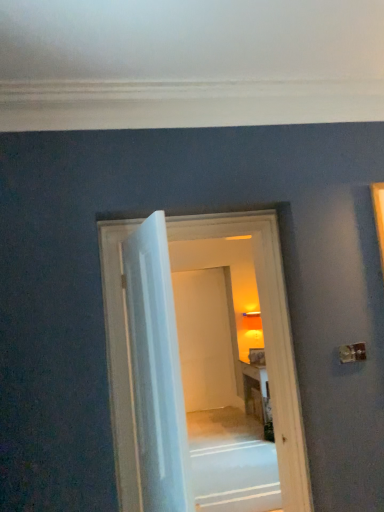
Question: Is white wooden door at center, the second door positioned from the front, not inside white glossy door at center, arranged as the 2th door when viewed from the back?

Choices:
 (A) no
 (B) yes

Answer: (B)

Question: From the image's perspective, does white wooden door at center, the first door from the back, appear lower than white glossy door at center, arranged as the 2th door when viewed from the back?

Choices:
 (A) yes
 (B) no

Answer: (A)

Question: Considering the relative positions of white wooden door at center, the first door from the back, and white glossy door at center, arranged as the 2th door when viewed from the back, in the image provided, is white wooden door at center, the first door from the back, behind white glossy door at center, arranged as the 2th door when viewed from the back,?

Choices:
 (A) yes
 (B) no

Answer: (A)

Question: Is white wooden door at center, the second door positioned from the front, oriented away from white glossy door at center, marked as the first door in a front-to-back arrangement?

Choices:
 (A) no
 (B) yes

Answer: (A)

Question: Can you confirm if white wooden door at center, the second door positioned from the front, is smaller than white glossy door at center, marked as the first door in a front-to-back arrangement?

Choices:
 (A) yes
 (B) no

Answer: (B)

Question: From a real-world perspective, is white wooden door at center, the second door positioned from the front, under white glossy door at center, marked as the first door in a front-to-back arrangement?

Choices:
 (A) no
 (B) yes

Answer: (B)

Question: Considering the relative sizes of white glossy door at center, marked as the first door in a front-to-back arrangement, and white wooden door at center, the second door positioned from the front, in the image provided, is white glossy door at center, marked as the first door in a front-to-back arrangement, taller than white wooden door at center, the second door positioned from the front,?

Choices:
 (A) no
 (B) yes

Answer: (A)

Question: Is white glossy door at center, arranged as the 2th door when viewed from the back, thinner than white wooden door at center, the first door from the back?

Choices:
 (A) no
 (B) yes

Answer: (B)

Question: Is white glossy door at center, arranged as the 2th door when viewed from the back, completely or partially outside of white wooden door at center, the first door from the back?

Choices:
 (A) no
 (B) yes

Answer: (B)

Question: From the image's perspective, does white glossy door at center, arranged as the 2th door when viewed from the back, appear higher than white wooden door at center, the second door positioned from the front?

Choices:
 (A) no
 (B) yes

Answer: (B)

Question: Does white glossy door at center, arranged as the 2th door when viewed from the back, have a greater width compared to white wooden door at center, the second door positioned from the front?

Choices:
 (A) yes
 (B) no

Answer: (B)

Question: Is white glossy door at center, marked as the first door in a front-to-back arrangement, smaller than white wooden door at center, the first door from the back?

Choices:
 (A) no
 (B) yes

Answer: (B)

Question: In terms of size, does white glossy door at center, marked as the first door in a front-to-back arrangement, appear bigger or smaller than white wooden door at center, the second door positioned from the front?

Choices:
 (A) big
 (B) small

Answer: (B)